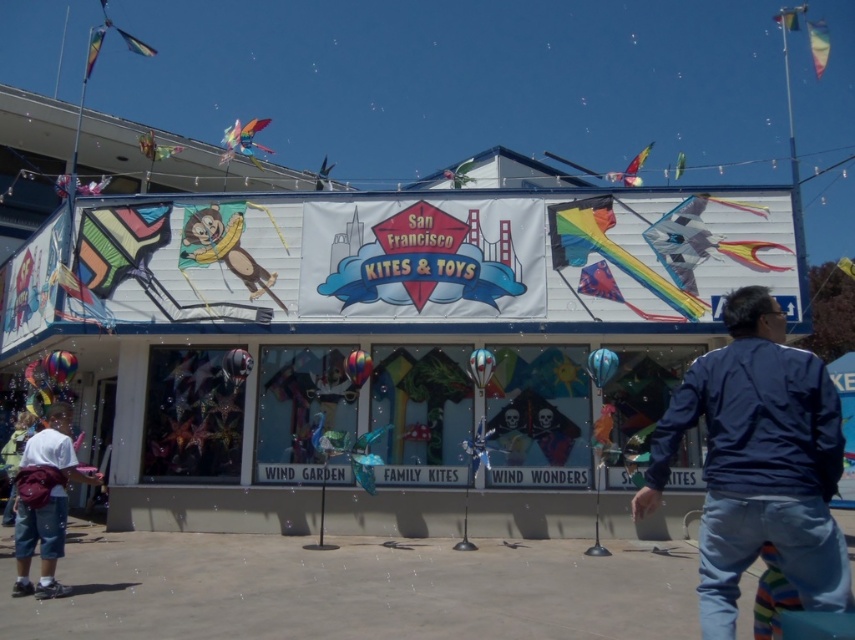
Can you confirm if blue fabric jacket at lower right is positioned to the right of metallic silver monkey at upper center?

Yes, blue fabric jacket at lower right is to the right of metallic silver monkey at upper center.

Between point (789, 376) and point (167, 147), which one is positioned behind?

The point (167, 147) is more distant.

What do you see at coordinates (758, 461) in the screenshot? The width and height of the screenshot is (855, 640). I see `blue fabric jacket at lower right` at bounding box center [758, 461].

Find the location of a particular element. The image size is (855, 640). blue fabric jacket at lower right is located at coordinates 758,461.

Which is more to the right, white cotton shirt at lower left or translucent plastic kite at upper center?

From the viewer's perspective, white cotton shirt at lower left appears more on the right side.

Is white cotton shirt at lower left behind translucent plastic kite at upper center?

No, white cotton shirt at lower left is in front of translucent plastic kite at upper center.

This screenshot has height=640, width=855. Find the location of `white cotton shirt at lower left`. white cotton shirt at lower left is located at coordinates (45, 500).

Does point (52, 566) come closer to viewer compared to point (157, 147)?

Yes, point (52, 566) is in front of point (157, 147).

Is white cotton shirt at lower left shorter than metallic silver monkey at upper center?

No, white cotton shirt at lower left is not shorter than metallic silver monkey at upper center.

Which is behind, point (28, 564) or point (146, 150)?

Point (146, 150)

Find the location of `white cotton shirt at lower left`. white cotton shirt at lower left is located at coordinates (45, 500).